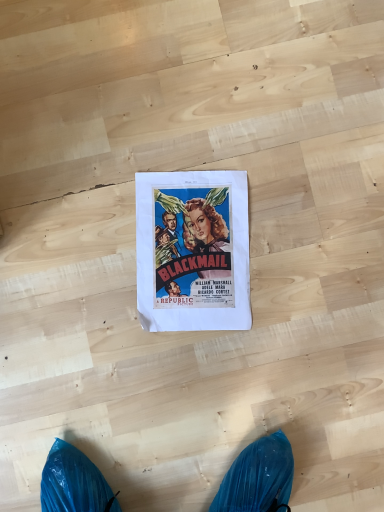
Locate an element on the screen. This screenshot has width=384, height=512. vacant area located to the right-hand side of matte paper poster at center is located at coordinates (312, 244).